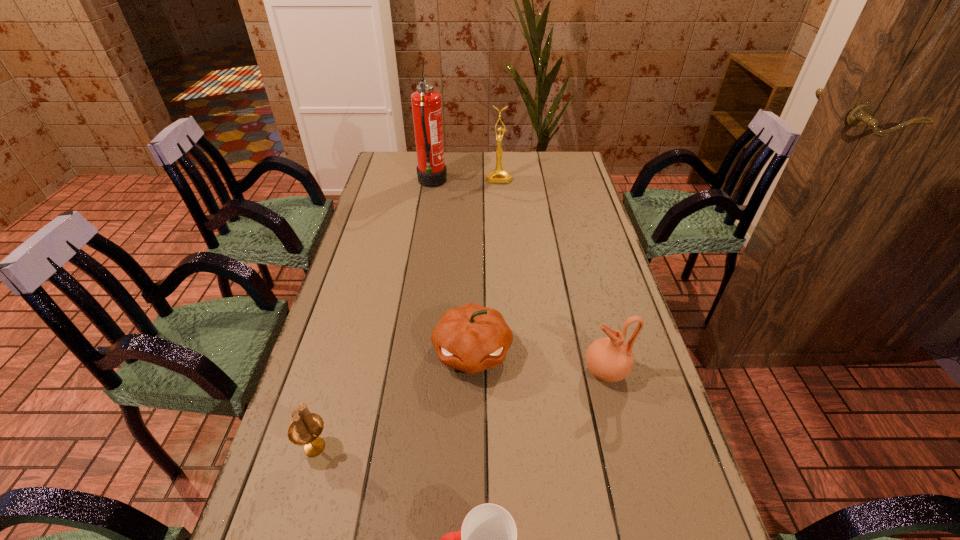
The height and width of the screenshot is (540, 960). I want to click on free space at the far right corner, so click(560, 156).

Find the location of a particular element. free space between the pumpkin and the fire extinguisher is located at coordinates (452, 268).

Identify the location of unoccupied position between the fifth shortest object and the tallest object. Image resolution: width=960 pixels, height=540 pixels. (466, 180).

Image resolution: width=960 pixels, height=540 pixels. Find the location of `vacant space that is in between the leftmost object and the pottery`. vacant space that is in between the leftmost object and the pottery is located at coordinates (460, 409).

Image resolution: width=960 pixels, height=540 pixels. In order to click on free space between the fifth shortest object and the candle holder in this screenshot , I will do `click(407, 312)`.

Image resolution: width=960 pixels, height=540 pixels. I want to click on vacant area between the fire extinguisher and the candle holder, so click(373, 315).

The height and width of the screenshot is (540, 960). Find the location of `free space between the award and the pumpkin`. free space between the award and the pumpkin is located at coordinates (486, 265).

Where is `free spot between the award and the pottery`? The image size is (960, 540). free spot between the award and the pottery is located at coordinates [552, 274].

This screenshot has width=960, height=540. What are the coordinates of `free spot between the rightmost object and the candle holder` in the screenshot? It's located at (460, 409).

Locate which object is the second closest to the leftmost object. Please provide its 2D coordinates. Your answer should be formatted as a tuple, i.e. [(x, y)], where the tuple contains the x and y coordinates of a point satisfying the conditions above.

[(488, 539)]